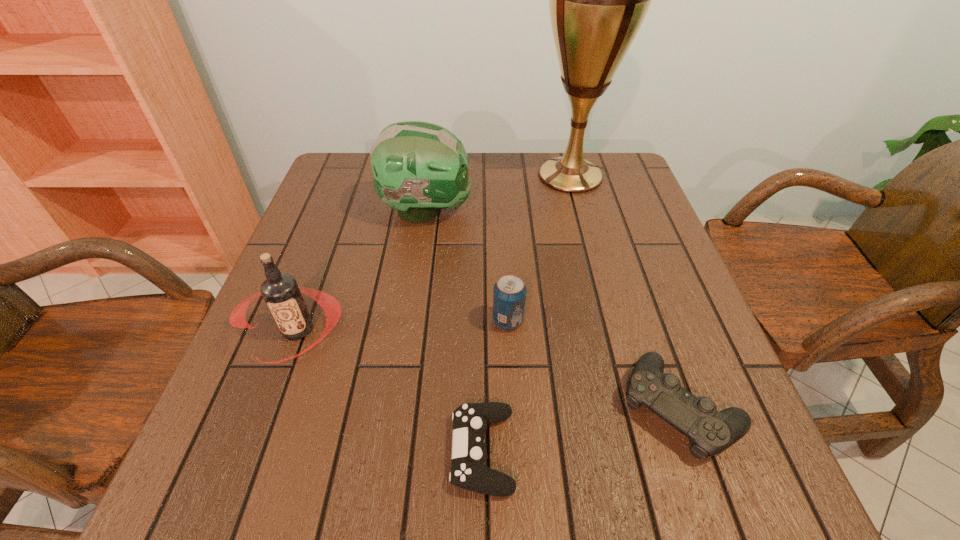
Locate an element on the screen. This screenshot has width=960, height=540. trophy cup that is at the right edge is located at coordinates (598, 0).

Where is `control that is at the right edge`? The width and height of the screenshot is (960, 540). control that is at the right edge is located at coordinates (711, 432).

The height and width of the screenshot is (540, 960). I want to click on object that is at the far right corner, so click(x=598, y=0).

In order to click on object located in the near right corner section of the desktop in this screenshot , I will do pos(711,432).

You are a GUI agent. You are given a task and a screenshot of the screen. Output one action in this format:
    pyautogui.click(x=<x>, y=<y>)
    Task: Click on the vacant space at the far edge
    
    Given the screenshot: What is the action you would take?
    pyautogui.click(x=484, y=181)

Where is `vacant space at the near edge of the desktop`? The image size is (960, 540). vacant space at the near edge of the desktop is located at coordinates (617, 482).

Locate an element on the screen. The width and height of the screenshot is (960, 540). vacant region at the left edge of the desktop is located at coordinates point(347,199).

In the image, there is a desktop. Identify the location of free space at the right edge. This screenshot has width=960, height=540. (657, 315).

The height and width of the screenshot is (540, 960). In order to click on free space at the far left corner in this screenshot , I will do `click(349, 167)`.

Locate an element on the screen. The image size is (960, 540). free space at the near left corner of the desktop is located at coordinates (208, 458).